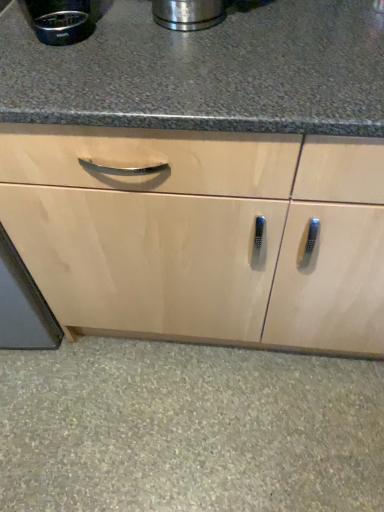
Question: From the image's perspective, relative to brushed metal coffee maker at upper left, is natural stone floor at lower center above or below?

Choices:
 (A) above
 (B) below

Answer: (B)

Question: Is natural stone floor at lower center bigger or smaller than brushed metal coffee maker at upper left?

Choices:
 (A) small
 (B) big

Answer: (B)

Question: Based on their positions, is natural stone floor at lower center located to the left or right of brushed metal coffee maker at upper left?

Choices:
 (A) right
 (B) left

Answer: (A)

Question: Relative to natural stone floor at lower center, is brushed metal coffee maker at upper left in front or behind?

Choices:
 (A) behind
 (B) front

Answer: (B)

Question: Based on their sizes in the image, would you say brushed metal coffee maker at upper left is bigger or smaller than natural stone floor at lower center?

Choices:
 (A) big
 (B) small

Answer: (B)

Question: From the image's perspective, is brushed metal coffee maker at upper left above or below natural stone floor at lower center?

Choices:
 (A) above
 (B) below

Answer: (A)

Question: Is point (54, 27) positioned closer to the camera than point (370, 488)?

Choices:
 (A) closer
 (B) farther

Answer: (A)